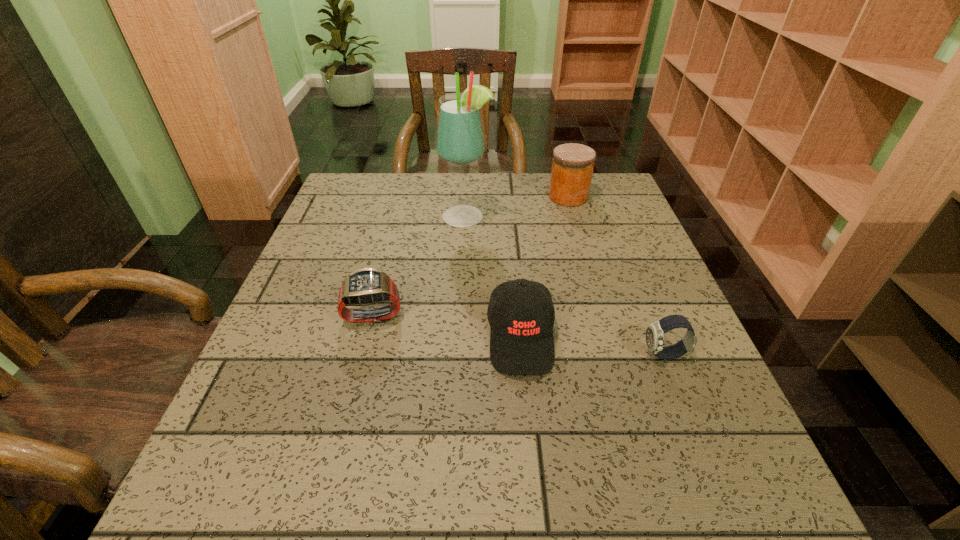
Where is `the tallest object`? The width and height of the screenshot is (960, 540). the tallest object is located at coordinates (460, 140).

Locate an element on the screen. This screenshot has height=540, width=960. jar is located at coordinates (572, 168).

Where is `baseball cap`? baseball cap is located at coordinates (521, 338).

The height and width of the screenshot is (540, 960). Identify the location of the farther watch. (367, 286).

I want to click on the leftmost object, so click(x=367, y=286).

This screenshot has width=960, height=540. Find the location of `the right watch`. the right watch is located at coordinates (655, 332).

Image resolution: width=960 pixels, height=540 pixels. I want to click on free space located on the back of the alcohol, so click(x=467, y=181).

Locate an element on the screen. vacant space located on the left of the jar is located at coordinates (513, 197).

Identify the location of free space located 0.170m on the front-facing side of the baseball cap. (534, 476).

Where is `vacant area situated 0.360m on the back of the farther watch`? vacant area situated 0.360m on the back of the farther watch is located at coordinates (399, 209).